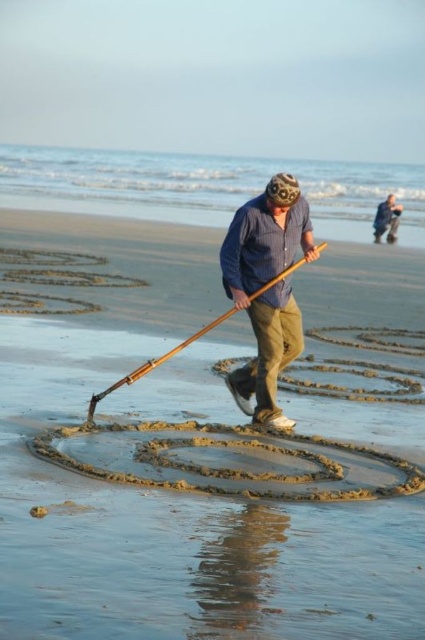
You are standing on the sandy beach at center and see the blue striped shirt at center. Which object is closer to the ground?

The sandy beach at center is positioned under the blue striped shirt at center, so the sandy beach at center is closer to the ground.

You are a photographer standing at the beach scene. You want to capture a wide shot that includes both the blue striped shirt at center and the blue striped shirt at upper center. Given that your camera has a maximum focal length of 200mm, which allows you to capture objects up to 70 feet apart in the same frame, will you be able to include both subjects in a single photo?

The blue striped shirt at center and blue striped shirt at upper center are 71.82 feet apart from each other. Since the maximum distance your camera can capture in one frame is 70 feet, you will not be able to include both subjects in a single photo without moving closer or adjusting your position.